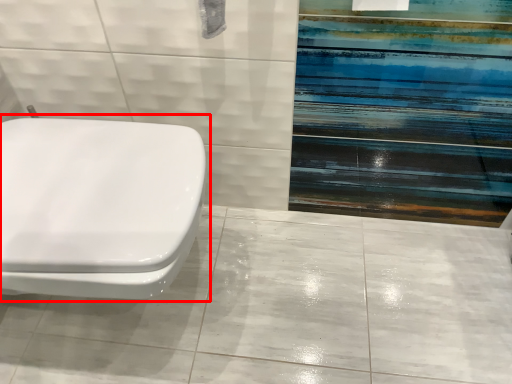
Question: From the image's perspective, where is toilet (annotated by the red box) located in relation to ceramic tile in the image?

Choices:
 (A) above
 (B) below

Answer: (A)